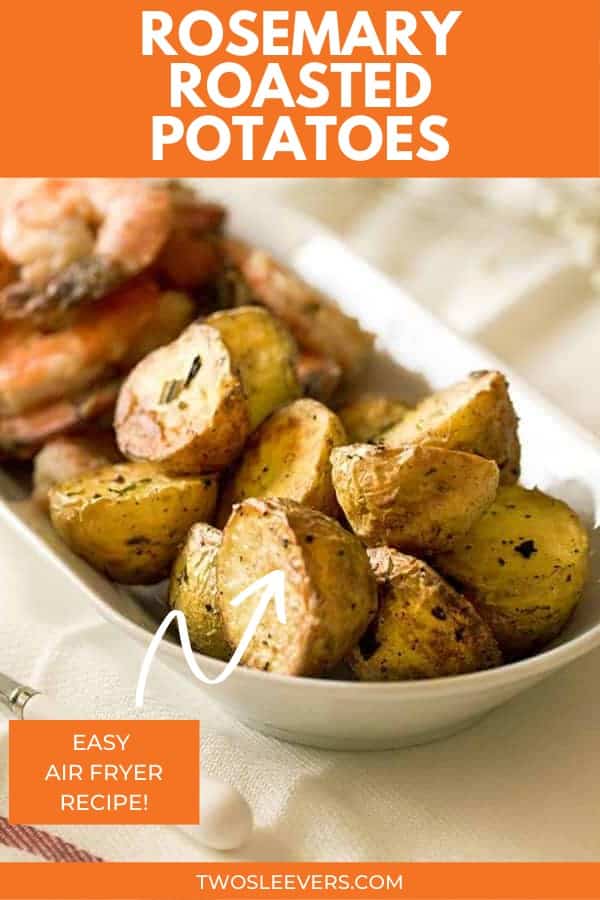
The height and width of the screenshot is (900, 600). In order to click on towel in this screenshot , I will do `click(323, 820)`, `click(490, 259)`.